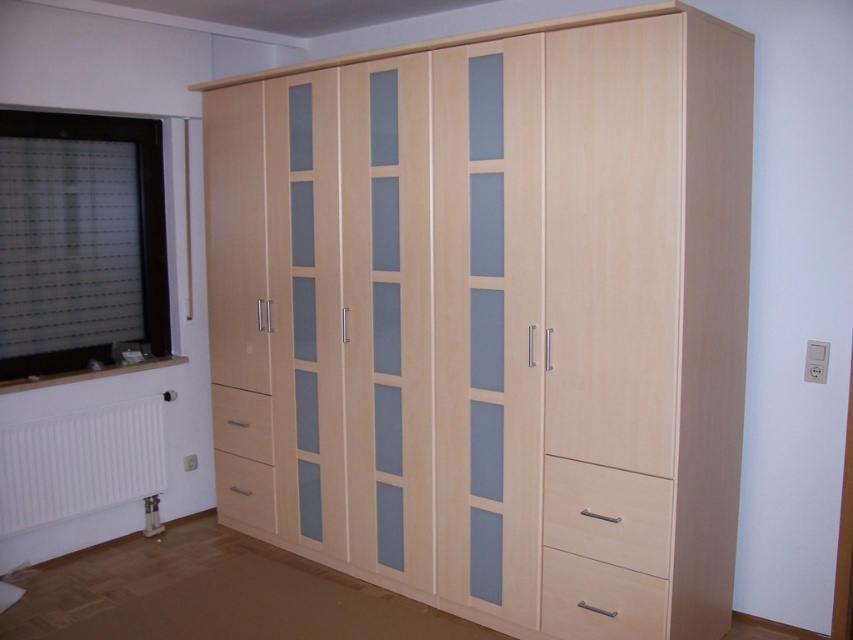
Question: Which of the following is the closest to the observer?

Choices:
 (A) white matte radiator at lower left
 (B) matte light brown drawer at lower left
 (C) light wood drawer at lower left

Answer: (A)

Question: From the image, what is the correct spatial relationship of matte light brown drawer at lower right in relation to matte light brown drawer at lower left?

Choices:
 (A) right
 (B) left

Answer: (A)

Question: Which of these objects is positioned closest to the matte light brown drawer at lower left?

Choices:
 (A) white matte radiator at lower left
 (B) light wood drawer at lower right

Answer: (A)

Question: Is matte light brown drawer at lower right to the left of light wood drawer at lower left from the viewer's perspective?

Choices:
 (A) no
 (B) yes

Answer: (A)

Question: Among these objects, which one is nearest to the camera?

Choices:
 (A) matte light brown drawer at lower right
 (B) light wood dresser at center
 (C) light wood drawer at lower right
 (D) light wood drawer at lower left

Answer: (B)

Question: Does light wood dresser at center appear on the right side of light wood drawer at lower left?

Choices:
 (A) yes
 (B) no

Answer: (A)